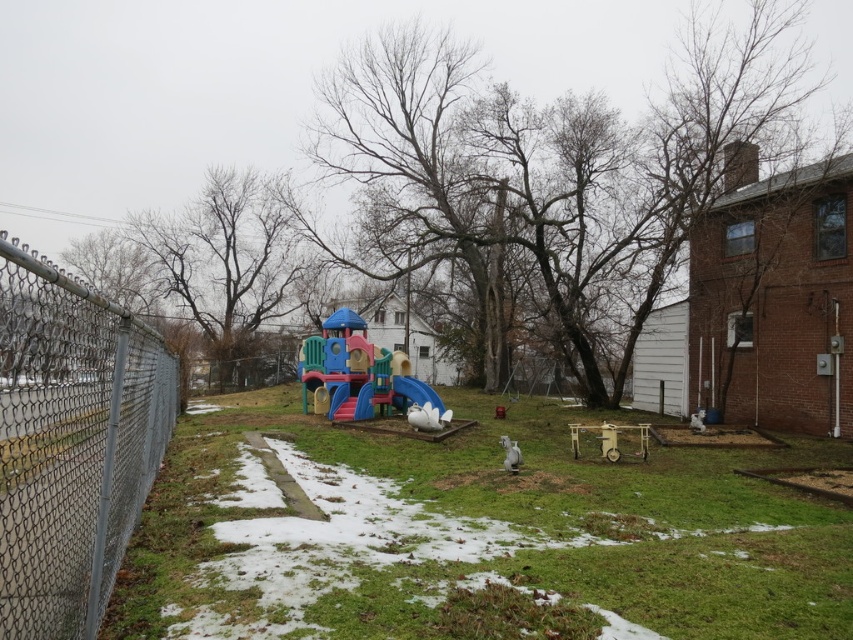
Question: Is gray chain-link fence at left above smooth plastic slide at center?

Choices:
 (A) yes
 (B) no

Answer: (A)

Question: Can you confirm if green grass at center is positioned to the left of multicolored plastic playground at center?

Choices:
 (A) yes
 (B) no

Answer: (B)

Question: Estimate the real-world distances between objects in this image. Which object is farther from the gray chain-link fence at left?

Choices:
 (A) multicolored plastic playground at center
 (B) smooth plastic slide at center
 (C) white plastic slide at center

Answer: (A)

Question: Considering the relative positions of gray chain-link fence at left and smooth plastic slide at center in the image provided, where is gray chain-link fence at left located with respect to smooth plastic slide at center?

Choices:
 (A) right
 (B) left

Answer: (A)

Question: Which point appears closest to the camera in this image?

Choices:
 (A) click(x=370, y=403)
 (B) click(x=431, y=394)
 (C) click(x=419, y=524)

Answer: (C)

Question: Which point is closer to the camera taking this photo?

Choices:
 (A) (407, 388)
 (B) (28, 540)
 (C) (349, 410)
 (D) (361, 388)

Answer: (B)